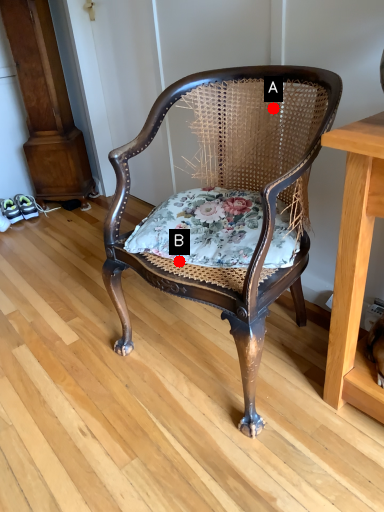
Question: Two points are circled on the image, labeled by A and B beside each circle. Which of the following is the closest to the observer?

Choices:
 (A) A is closer
 (B) B is closer

Answer: (B)